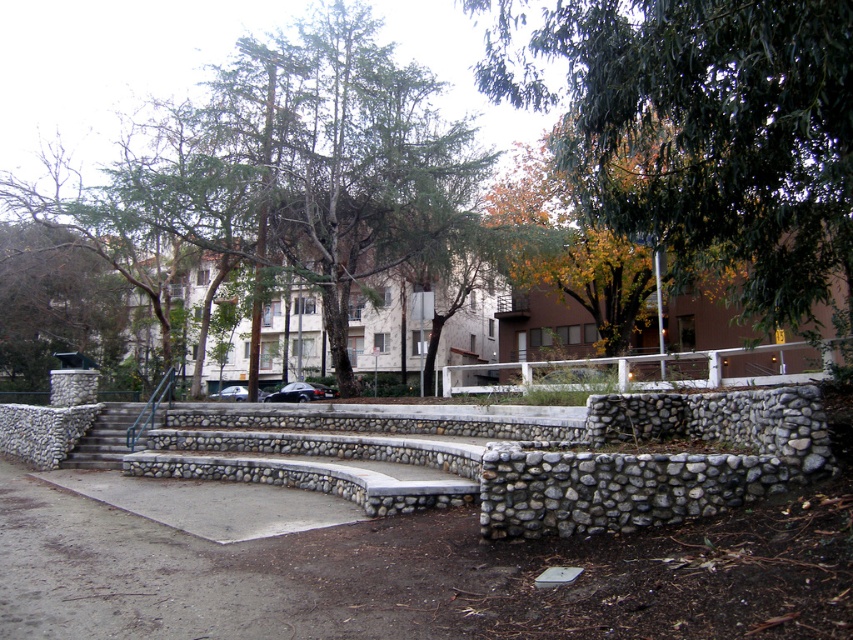
Question: Is white wooden rail at center in front of gray concrete stairs at center?

Choices:
 (A) yes
 (B) no

Answer: (A)

Question: Estimate the real-world distances between objects in this image. Which object is closer to the gray concrete stairs at center?

Choices:
 (A) green leafy tree at upper center
 (B) white wooden rail at center

Answer: (B)

Question: Is green leafy tree at upper center closer to the viewer compared to white wooden rail at center?

Choices:
 (A) yes
 (B) no

Answer: (A)

Question: Which object appears closest to the camera in this image?

Choices:
 (A) gray concrete stairs at center
 (B) white wooden rail at center
 (C) green leafy tree at upper center

Answer: (C)

Question: Is white wooden rail at center thinner than gray concrete stairs at center?

Choices:
 (A) no
 (B) yes

Answer: (A)

Question: Which object appears farthest from the camera in this image?

Choices:
 (A) green leafy tree at upper center
 (B) gray concrete stairs at center

Answer: (B)